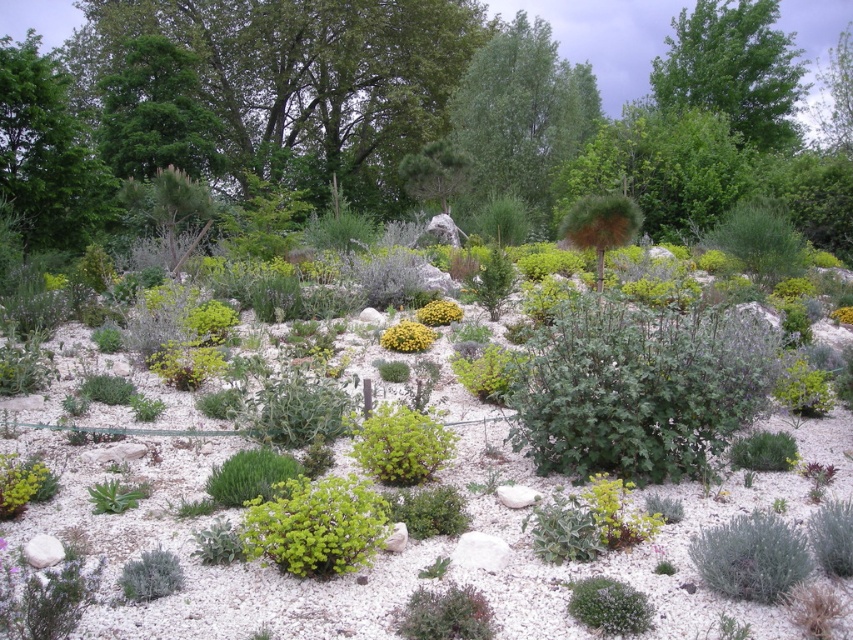
Between point (422, 24) and point (407, 321), which one is positioned behind?

The point (422, 24) is behind.

Identify the location of green leafy tree at upper left. The width and height of the screenshot is (853, 640). (306, 80).

Locate an element on the screen. The image size is (853, 640). green leafy tree at upper left is located at coordinates (306, 80).

Where is `green leafy tree at upper left`? green leafy tree at upper left is located at coordinates (306, 80).

Is green leafy tree at upper left above green leafy plant at center?

Indeed, green leafy tree at upper left is positioned over green leafy plant at center.

Find the location of `green leafy tree at upper left`. green leafy tree at upper left is located at coordinates (306, 80).

Does point (201, 26) come closer to viewer compared to point (621, 540)?

No.

Locate an element on the screen. green leafy tree at upper left is located at coordinates (306, 80).

Who is more forward, (508, 144) or (428, 317)?

Point (428, 317) is more forward.

This screenshot has width=853, height=640. What do you see at coordinates (521, 116) in the screenshot? I see `green leafy tree at upper center` at bounding box center [521, 116].

Find the location of a particular element. The height and width of the screenshot is (640, 853). green leafy tree at upper center is located at coordinates (521, 116).